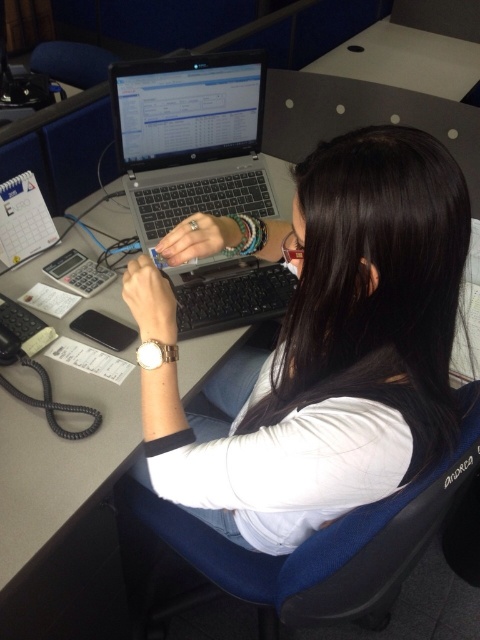
Which is above, blue fabric chair at center or silver/black laptop at center?

silver/black laptop at center

Does blue fabric chair at center have a larger size compared to silver/black laptop at center?

Yes, blue fabric chair at center is bigger than silver/black laptop at center.

Does point (196, 541) lie behind point (159, 200)?

No, (196, 541) is in front of (159, 200).

At what (x,y) coordinates should I click in order to perform the action: click on blue fabric chair at center. Please return your answer as a coordinate pair (x, y). Looking at the image, I should click on (309, 547).

Which is behind, point (351, 564) or point (384, 49)?

The point (384, 49) is more distant.

Does point (369, 589) come in front of point (372, 36)?

Yes.

Which is in front, point (384, 509) or point (313, 68)?

Point (384, 509) is in front.

Locate an element on the screen. This screenshot has height=640, width=480. blue fabric chair at center is located at coordinates (309, 547).

Between silver/black laptop at center and white plastic table at upper center, which one appears on the right side from the viewer's perspective?

white plastic table at upper center

Between point (149, 108) and point (428, 42), which one is positioned behind?

The point (428, 42) is behind.

Locate an element on the screen. The width and height of the screenshot is (480, 640). silver/black laptop at center is located at coordinates (191, 138).